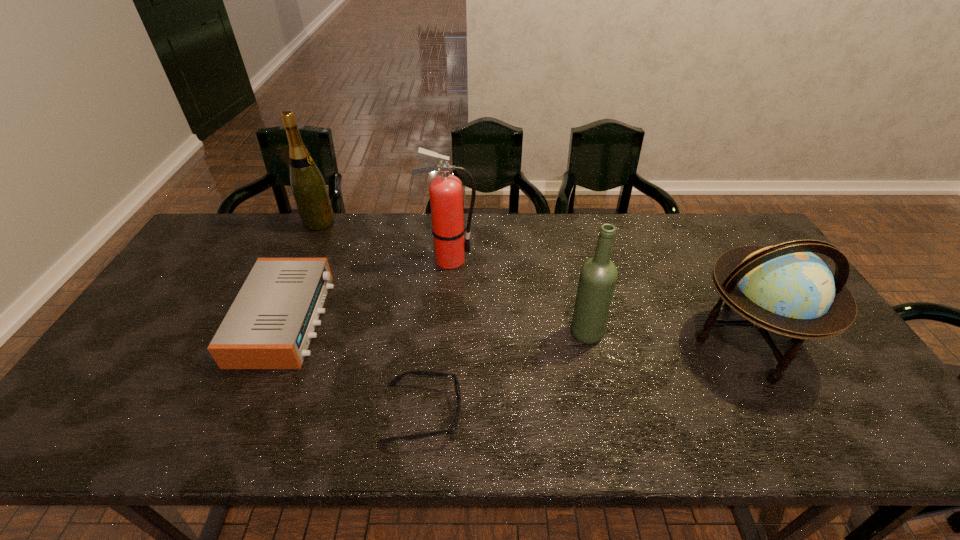
Locate an element on the screen. The image size is (960, 540). vacant area that lies between the second farthest object and the second object from right to left is located at coordinates (517, 296).

The height and width of the screenshot is (540, 960). In order to click on empty space between the second object from right to left and the shortest object in this screenshot , I will do [x=504, y=373].

Find the location of a particular element. This screenshot has width=960, height=540. vacant space that's between the farther wine bottle and the shortest object is located at coordinates (371, 318).

Find the location of a particular element. The height and width of the screenshot is (540, 960). vacant space in between the right wine bottle and the spectacles is located at coordinates (504, 373).

The image size is (960, 540). Find the location of `unoccupied position between the right wine bottle and the spectacles`. unoccupied position between the right wine bottle and the spectacles is located at coordinates (504, 373).

Where is `the third closest object to the spectacles`? Image resolution: width=960 pixels, height=540 pixels. the third closest object to the spectacles is located at coordinates (446, 191).

Choose which object is the second nearest neighbor to the rightmost object. Please provide its 2D coordinates. Your answer should be formatted as a tuple, i.e. [(x, y)], where the tuple contains the x and y coordinates of a point satisfying the conditions above.

[(446, 191)]

This screenshot has width=960, height=540. I want to click on vacant area that satisfies the following two spatial constraints: 1. on the front-facing side of the farther wine bottle; 2. on the left side of the second object from right to left, so click(270, 333).

The width and height of the screenshot is (960, 540). Identify the location of vacant position in the image that satisfies the following two spatial constraints: 1. on the control panel of the fifth object from left to right; 2. on the left side of the radio receiver. (279, 333).

You are a GUI agent. You are given a task and a screenshot of the screen. Output one action in this format:
    pyautogui.click(x=<x>, y=<y>)
    Task: Click on the free location that satisfies the following two spatial constraints: 1. on the hose direction of the fire extinguisher; 2. on the left side of the nearer wine bottle
    This screenshot has width=960, height=540.
    Given the screenshot: What is the action you would take?
    pyautogui.click(x=444, y=333)